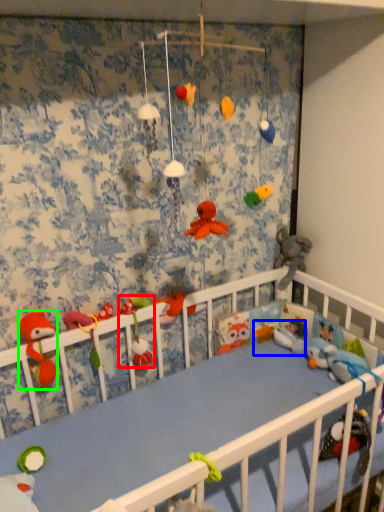
Question: Which object is the farthest from toy (highlighted by a red box)? Choose among these: toy (highlighted by a blue box) or toy (highlighted by a green box).

Choices:
 (A) toy
 (B) toy

Answer: (A)